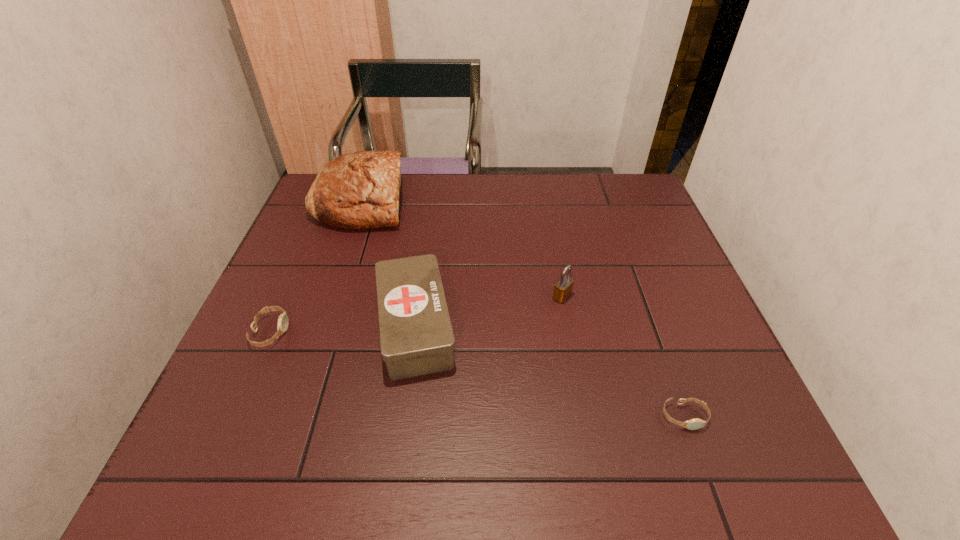
Choose which object is the fourth nearest neighbor to the first-aid kit. Please provide its 2D coordinates. Your answer should be formatted as a tuple, i.e. [(x, y)], where the tuple contains the x and y coordinates of a point satisfying the conditions above.

[(693, 424)]

This screenshot has width=960, height=540. Find the location of `vacant region that satisfies the following two spatial constraints: 1. at the sliced front of the tallest object; 2. on the right side of the first-aid kit`. vacant region that satisfies the following two spatial constraints: 1. at the sliced front of the tallest object; 2. on the right side of the first-aid kit is located at coordinates (320, 326).

I want to click on free space that satisfies the following two spatial constraints: 1. at the sliced front of the first-aid kit; 2. on the left side of the tallest object, so click(x=320, y=326).

Where is `blank area in the image that satisfies the following two spatial constraints: 1. at the sliced front of the tallest object; 2. on the back side of the padlock`? This screenshot has width=960, height=540. blank area in the image that satisfies the following two spatial constraints: 1. at the sliced front of the tallest object; 2. on the back side of the padlock is located at coordinates (329, 296).

Where is `free space in the image that satisfies the following two spatial constraints: 1. at the sliced front of the fourth object from left to right; 2. on the left side of the farthest object`? The height and width of the screenshot is (540, 960). free space in the image that satisfies the following two spatial constraints: 1. at the sliced front of the fourth object from left to right; 2. on the left side of the farthest object is located at coordinates click(329, 296).